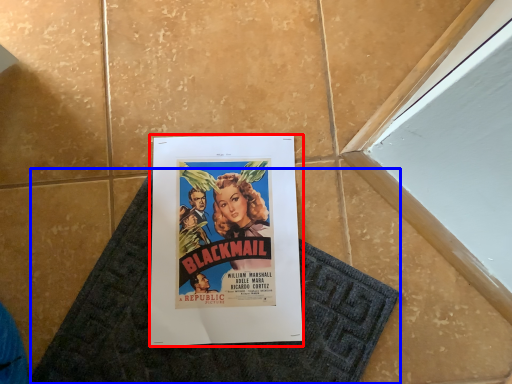
Question: Which of the following is the farthest to the observer, poster (highlighted by a red box) or bath mat (highlighted by a blue box)?

Choices:
 (A) poster
 (B) bath mat

Answer: (A)